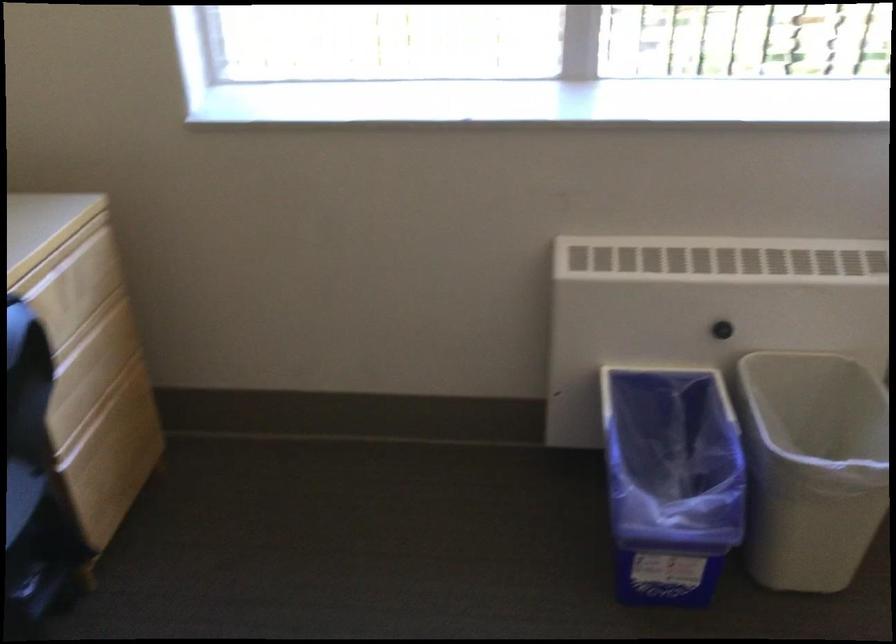
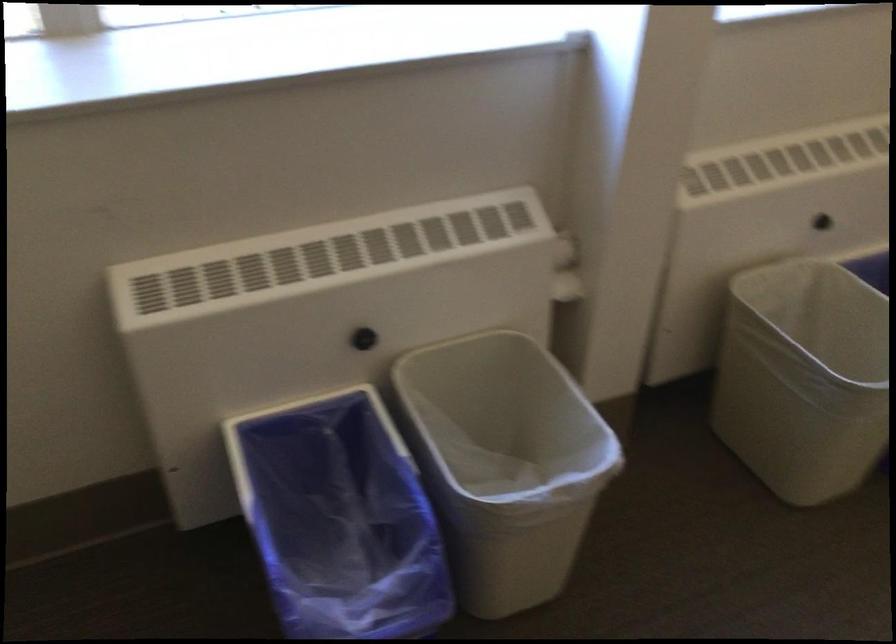
Where in the second image is the point corresponding to point 719,327 from the first image?

(364, 339)